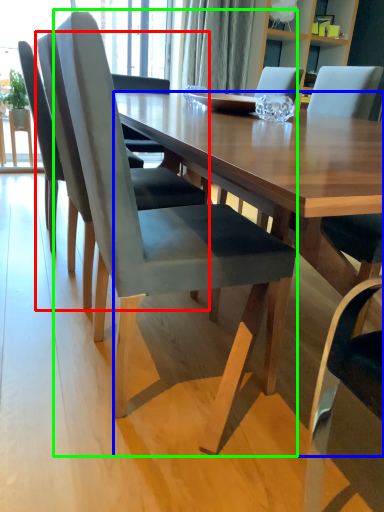
Question: Which object is positioned closest to chair (highlighted by a red box)? Select from desk (highlighted by a blue box) and chair (highlighted by a green box).

Choices:
 (A) desk
 (B) chair

Answer: (B)